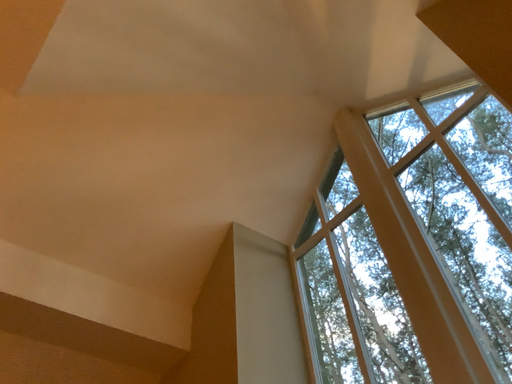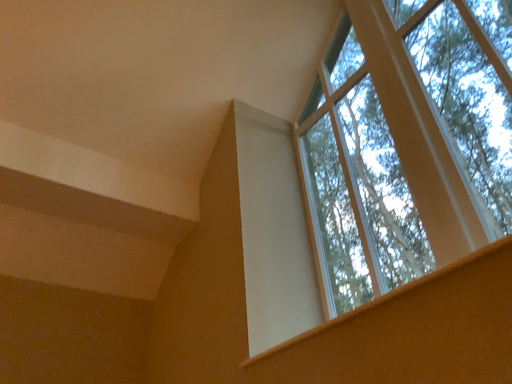
Question: Which way did the camera rotate in the video?

Choices:
 (A) rotated downward
 (B) rotated upward

Answer: (A)